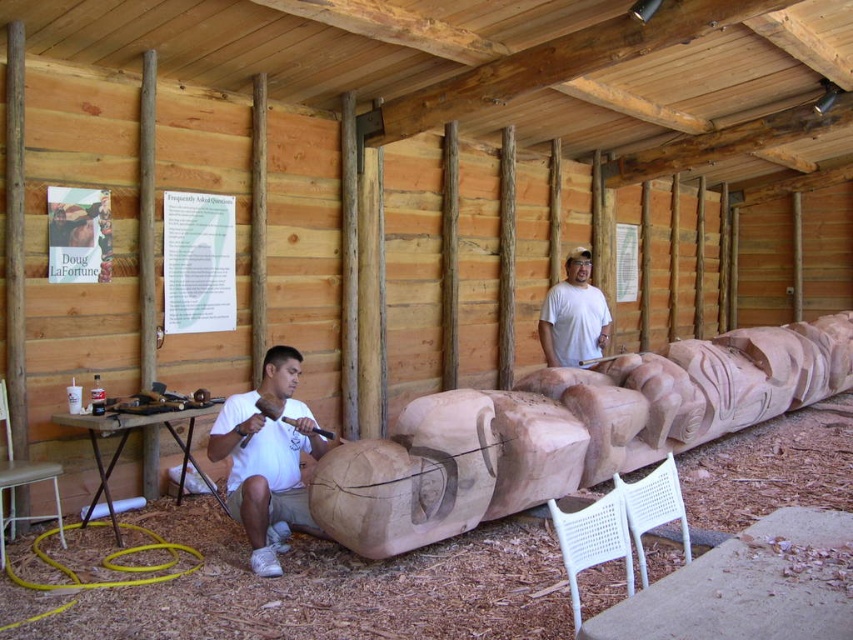
Question: Which of these objects is positioned farthest from the white matte shirt at lower left?

Choices:
 (A) brushed metal chisel at left
 (B) white wicker chair at lower right
 (C) white matte shirt at center
 (D) metallic stool at lower left

Answer: (C)

Question: Does white matte shirt at center appear over white plastic chair at lower right?

Choices:
 (A) yes
 (B) no

Answer: (A)

Question: Among these points, which one is nearest to the camera?

Choices:
 (A) (152, 401)
 (B) (225, 448)
 (C) (57, 513)
 (D) (592, 298)

Answer: (B)

Question: Does white matte shirt at center have a greater width compared to brushed metal chisel at left?

Choices:
 (A) no
 (B) yes

Answer: (B)

Question: Is white matte shirt at center closer to the viewer compared to white plastic chair at lower right?

Choices:
 (A) no
 (B) yes

Answer: (A)

Question: Which point is closer to the camera taking this photo?

Choices:
 (A) pyautogui.click(x=601, y=554)
 (B) pyautogui.click(x=1, y=493)
 (C) pyautogui.click(x=299, y=452)

Answer: (A)